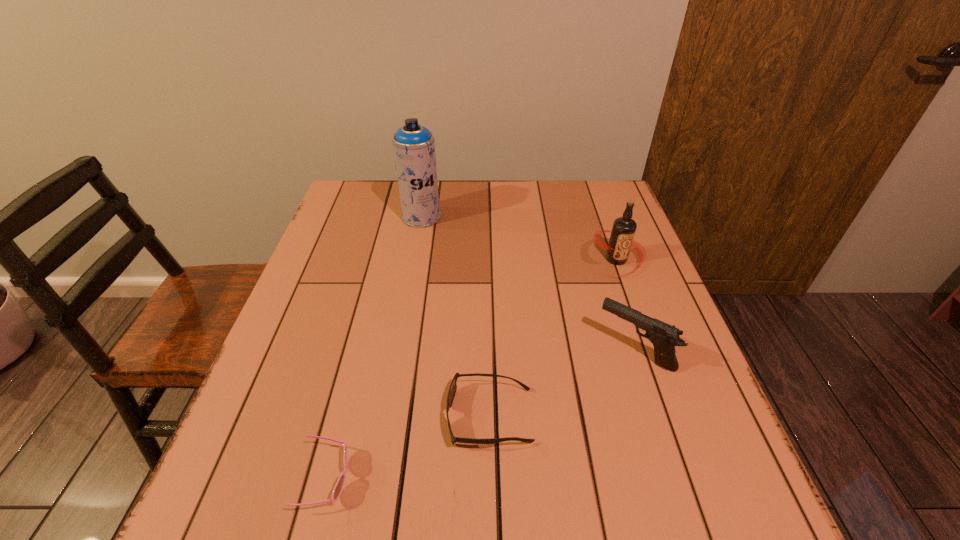
This screenshot has height=540, width=960. I want to click on free space located at the muzzle of the third nearest object, so click(x=562, y=351).

You are a GUI agent. You are given a task and a screenshot of the screen. Output one action in this format:
    pyautogui.click(x=<x>, y=<y>)
    Task: Click on the vacant area situated at the muzzle of the third nearest object
    The image size is (960, 540).
    Given the screenshot: What is the action you would take?
    pyautogui.click(x=478, y=351)

Where is `vacant region located at the muzzle of the third nearest object`? The height and width of the screenshot is (540, 960). vacant region located at the muzzle of the third nearest object is located at coordinates (557, 351).

I want to click on blank space located on the front-facing side of the right sunglasses, so click(x=294, y=416).

What are the coordinates of `vacant area located 0.340m on the front-facing side of the right sunglasses` in the screenshot? It's located at (268, 416).

Where is `vacant space located 0.340m on the front-facing side of the right sunglasses`? vacant space located 0.340m on the front-facing side of the right sunglasses is located at coordinates (268, 416).

At what (x,y) coordinates should I click in order to perform the action: click on free spot located on the front-facing side of the left sunglasses. Please return your answer as a coordinate pair (x, y). The width and height of the screenshot is (960, 540). Looking at the image, I should click on 385,479.

Where is `object that is at the far edge`? object that is at the far edge is located at coordinates (413, 144).

Where is `object that is at the near edge`? This screenshot has width=960, height=540. object that is at the near edge is located at coordinates (338, 488).

At what (x,y) coordinates should I click in order to perform the action: click on object that is at the left edge. Please return your answer as a coordinate pair (x, y). The width and height of the screenshot is (960, 540). Looking at the image, I should click on (338, 488).